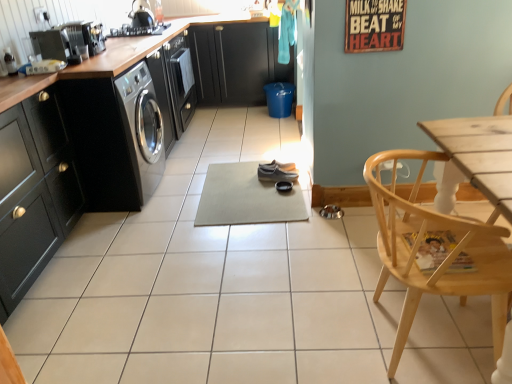
The height and width of the screenshot is (384, 512). In order to click on vacant location below light wood chair at lower right (from a real-world perspective) in this screenshot , I will do `click(414, 336)`.